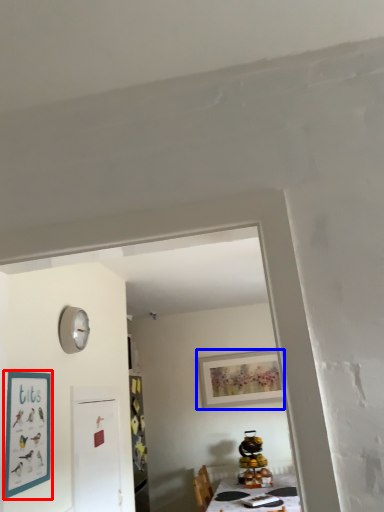
Question: Which object appears closest to the camera in this image, picture frame (highlighted by a red box) or picture frame (highlighted by a blue box)?

Choices:
 (A) picture frame
 (B) picture frame

Answer: (A)